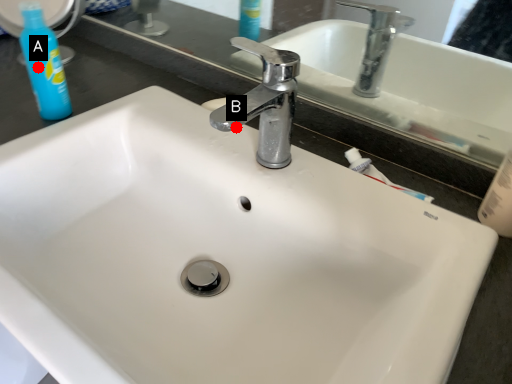
Question: Two points are circled on the image, labeled by A and B beside each circle. Which point is further to the camera?

Choices:
 (A) A is further
 (B) B is further

Answer: (B)